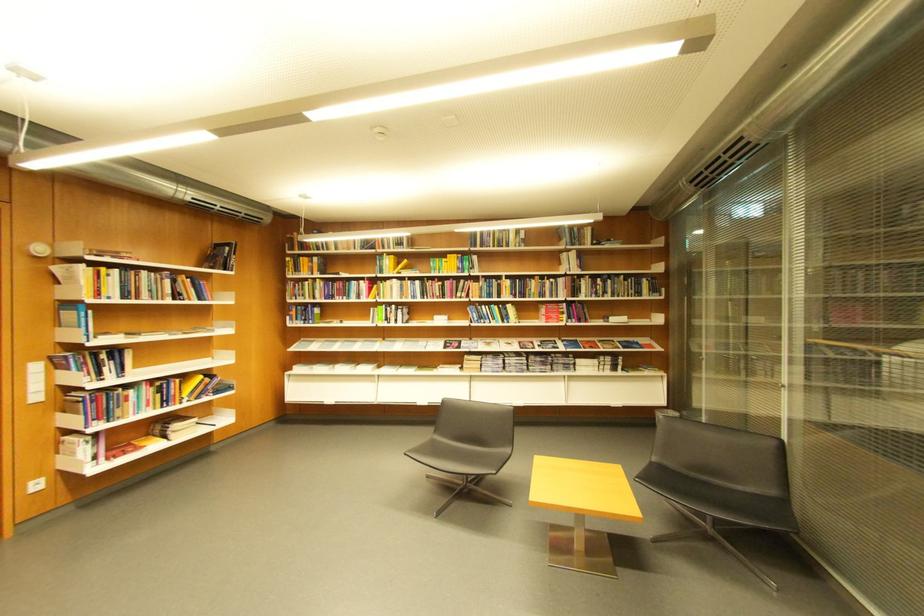
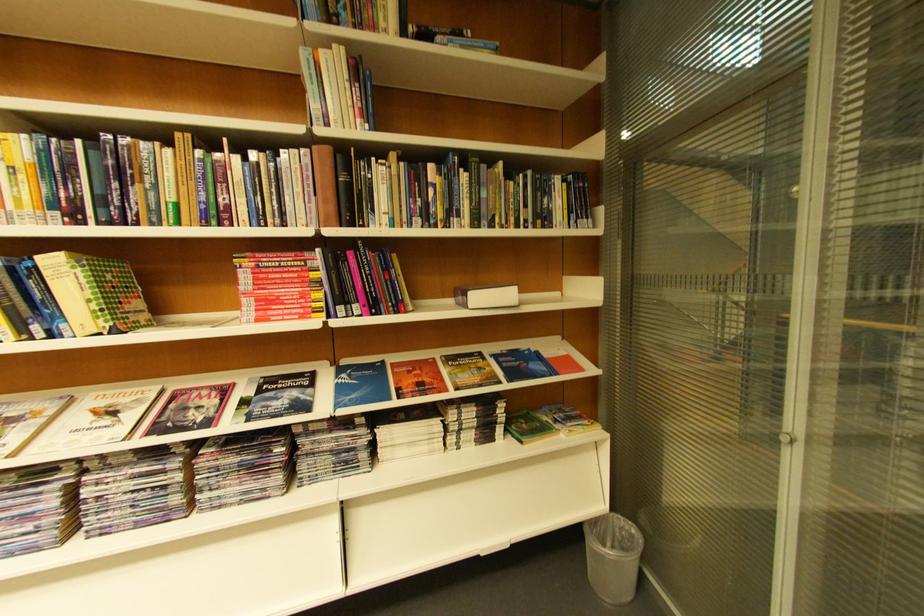
In the second image, find the point that corresponds to pixel 518 308 in the first image.

(63, 264)